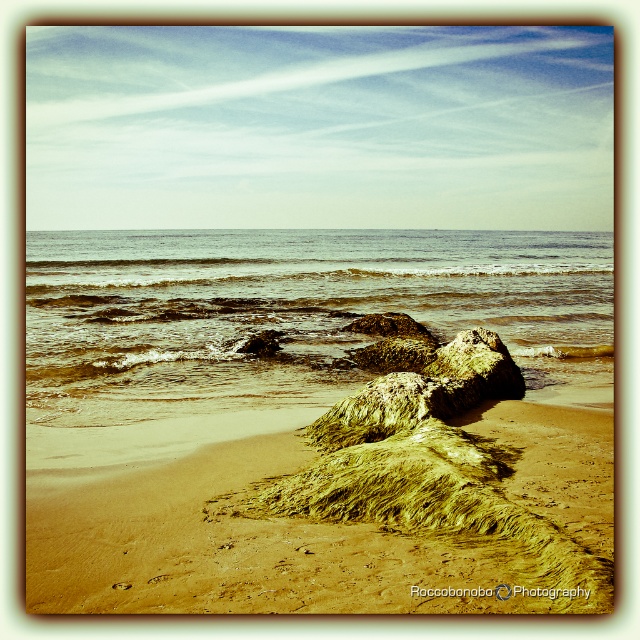
Looking at this image, can you confirm if golden sandy beach at center is positioned above clear water at center?

No.

Which is in front, point (381, 554) or point (312, 339)?

Point (381, 554) is more forward.

Where is `golden sandy beach at center`? This screenshot has width=640, height=640. golden sandy beach at center is located at coordinates (342, 524).

The width and height of the screenshot is (640, 640). Find the location of `golden sandy beach at center`. golden sandy beach at center is located at coordinates (342, 524).